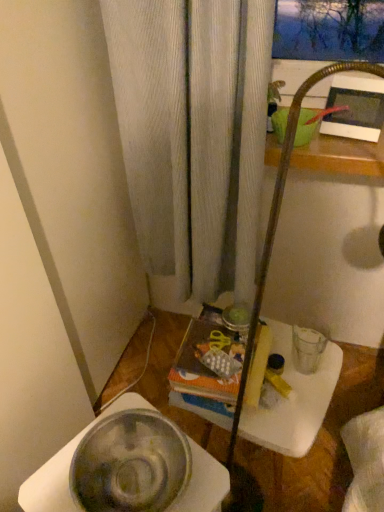
What is the approximate height of metallic silver bowl at lower left, acting as the 1th basin starting from the front?

metallic silver bowl at lower left, acting as the 1th basin starting from the front, is 8.53 centimeters tall.

Find the location of `clear plastic table at center`. clear plastic table at center is located at coordinates (291, 398).

Who is smaller, metallic silver bowl at lower left, which appears as the 2th basin when viewed from the right, or clear plastic table at center?

Smaller between the two is metallic silver bowl at lower left, which appears as the 2th basin when viewed from the right.

Is the position of metallic silver bowl at lower left, acting as the 1th basin starting from the front, more distant than that of clear plastic table at center?

No, metallic silver bowl at lower left, acting as the 1th basin starting from the front, is in front of clear plastic table at center.

Which object is positioned more to the left, metallic silver bowl at lower left, which appears as the second basin when viewed from the top, or clear plastic table at center?

From the viewer's perspective, metallic silver bowl at lower left, which appears as the second basin when viewed from the top, appears more on the left side.

Considering the points (143, 471) and (220, 410), which point is behind, point (143, 471) or point (220, 410)?

The point (220, 410) is behind.

Does point (172, 449) come closer to viewer compared to point (304, 115)?

Yes.

Is metallic silver bowl at lower left, the 1th basin viewed from the left, thinner than green matte basin at upper right, positioned as the second basin in left-to-right order?

No.

Based on the photo, choose the correct answer: Is metallic silver bowl at lower left, which is the first basin from bottom to top, inside green matte basin at upper right, the first basin from the right, or outside it?

metallic silver bowl at lower left, which is the first basin from bottom to top, lies outside green matte basin at upper right, the first basin from the right.

Can you tell me how much metallic silver bowl at lower left, acting as the 1th basin starting from the front, and green matte basin at upper right, acting as the second basin starting from the bottom, differ in facing direction?

metallic silver bowl at lower left, acting as the 1th basin starting from the front, and green matte basin at upper right, acting as the second basin starting from the bottom, are facing 67.6 degrees away from each other.

From the picture: From a real-world perspective, between green matte basin at upper right, positioned as the second basin in left-to-right order, and metallic silver bowl at lower left, which appears as the 2th basin when viewed from the right, who is vertically higher?

green matte basin at upper right, positioned as the second basin in left-to-right order.

Which is more to the right, green matte basin at upper right, placed as the 1th basin when sorted from top to bottom, or metallic silver bowl at lower left, acting as the 1th basin starting from the front?

Positioned to the right is green matte basin at upper right, placed as the 1th basin when sorted from top to bottom.

Considering the positions of objects green matte basin at upper right, acting as the second basin starting from the bottom, and metallic silver bowl at lower left, which appears as the 2th basin when viewed from the right, in the image provided, who is behind, green matte basin at upper right, acting as the second basin starting from the bottom, or metallic silver bowl at lower left, which appears as the 2th basin when viewed from the right,?

green matte basin at upper right, acting as the second basin starting from the bottom, is further away from the camera.

Is point (287, 109) farther from viewer compared to point (116, 484)?

Yes, it is behind point (116, 484).

From the image's perspective, is clear plastic table at center positioned above or below green matte basin at upper right, the first basin from the right?

clear plastic table at center is situated lower than green matte basin at upper right, the first basin from the right, in the image.

Which object is thinner, clear plastic table at center or green matte basin at upper right, placed as the 1th basin when sorted from top to bottom?

With smaller width is green matte basin at upper right, placed as the 1th basin when sorted from top to bottom.

Is clear plastic table at center oriented towards green matte basin at upper right, the first basin from the right?

No, clear plastic table at center is not oriented towards green matte basin at upper right, the first basin from the right.

Find the location of a particular element. basin on the right of clear plastic table at center is located at coordinates (305, 127).

In the scene shown: Is the surface of clear plastic table at center in direct contact with metallic silver bowl at lower left, the 1th basin viewed from the left?

No, clear plastic table at center is not with metallic silver bowl at lower left, the 1th basin viewed from the left.

What's the angular difference between clear plastic table at center and metallic silver bowl at lower left, the 1th basin viewed from the left,'s facing directions?

12.9 degrees.

From the picture: Would you say metallic silver bowl at lower left, which is the first basin from bottom to top, is part of clear plastic table at center's contents?

No, metallic silver bowl at lower left, which is the first basin from bottom to top, is not a part of clear plastic table at center.

In order to click on basin that is the 1st one when counting upward from the clear plastic table at center (from the image's perspective) in this screenshot , I will do `click(130, 464)`.

From the image's perspective, is green matte basin at upper right, placed as the 1th basin when sorted from top to bottom, positioned above or below clear plastic table at center?

Clearly, from the image's perspective, green matte basin at upper right, placed as the 1th basin when sorted from top to bottom, is above clear plastic table at center.

Is green matte basin at upper right, the first basin from the right, aimed at clear plastic table at center?

No, green matte basin at upper right, the first basin from the right, is not oriented towards clear plastic table at center.

Is clear plastic table at center surrounded by green matte basin at upper right, which ranks as the 1th basin in back-to-front order?

That's incorrect, clear plastic table at center is not inside green matte basin at upper right, which ranks as the 1th basin in back-to-front order.

Is green matte basin at upper right, the first basin from the right, wider than clear plastic table at center?

No, green matte basin at upper right, the first basin from the right, is not wider than clear plastic table at center.

You are a GUI agent. You are given a task and a screenshot of the screen. Output one action in this format:
    pyautogui.click(x=<x>, y=<y>)
    Task: Click on the table below the metallic silver bowl at lower left, the 1th basin viewed from the left (from the image's perspective)
    This screenshot has height=512, width=384.
    Given the screenshot: What is the action you would take?
    pyautogui.click(x=291, y=398)

At what (x,y) coordinates should I click in order to perform the action: click on basin in front of the green matte basin at upper right, the first basin from the right. Please return your answer as a coordinate pair (x, y). Looking at the image, I should click on [x=130, y=464].

From the image, which object appears to be nearer to metallic silver bowl at lower left, which appears as the 2th basin when viewed from the right, clear plastic table at center or green matte basin at upper right, which ranks as the 2th basin in front-to-back order?

clear plastic table at center.

From the image, which object appears to be farther from green matte basin at upper right, placed as the 1th basin when sorted from top to bottom, metallic silver bowl at lower left, which appears as the 2th basin when viewed from the right, or clear plastic table at center?

metallic silver bowl at lower left, which appears as the 2th basin when viewed from the right.

Considering their positions, is metallic silver bowl at lower left, which is the 2th basin in back-to-front order, positioned further to clear plastic table at center than green matte basin at upper right, positioned as the second basin in left-to-right order?

green matte basin at upper right, positioned as the second basin in left-to-right order, is further to clear plastic table at center.

Estimate the real-world distances between objects in this image. Which object is further from clear plastic table at center, green matte basin at upper right, positioned as the second basin in left-to-right order, or metallic silver bowl at lower left, which is the first basin from bottom to top?

green matte basin at upper right, positioned as the second basin in left-to-right order, is positioned further to the anchor clear plastic table at center.

Considering their positions, is clear plastic table at center positioned further to green matte basin at upper right, acting as the second basin starting from the bottom, than metallic silver bowl at lower left, acting as the 1th basin starting from the front?

The object further to green matte basin at upper right, acting as the second basin starting from the bottom, is metallic silver bowl at lower left, acting as the 1th basin starting from the front.

Estimate the real-world distances between objects in this image. Which object is further from metallic silver bowl at lower left, which appears as the 2th basin when viewed from the right, green matte basin at upper right, acting as the second basin starting from the bottom, or clear plastic table at center?

The object further to metallic silver bowl at lower left, which appears as the 2th basin when viewed from the right, is green matte basin at upper right, acting as the second basin starting from the bottom.

The height and width of the screenshot is (512, 384). What are the coordinates of `basin between green matte basin at upper right, acting as the second basin starting from the bottom, and clear plastic table at center, in the vertical direction` in the screenshot? It's located at (130, 464).